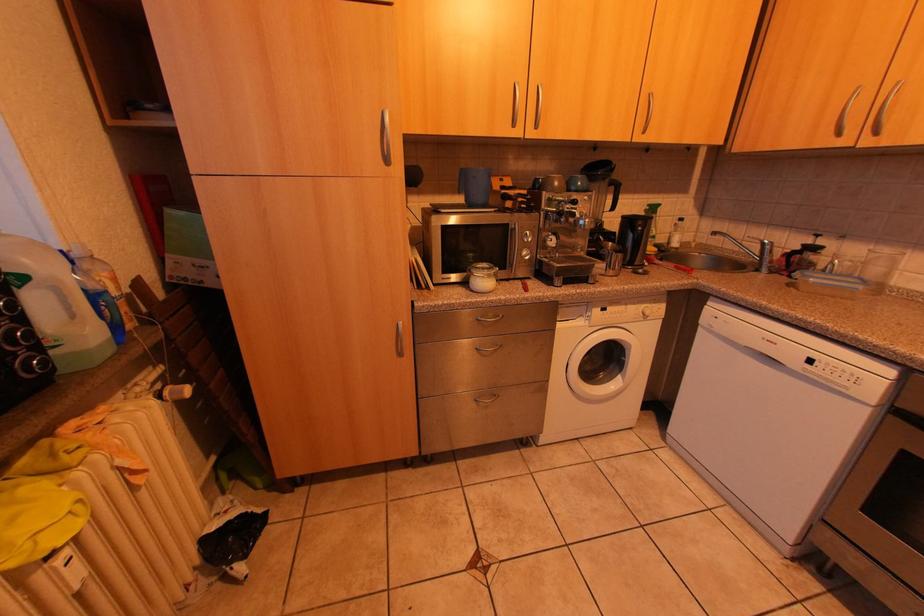
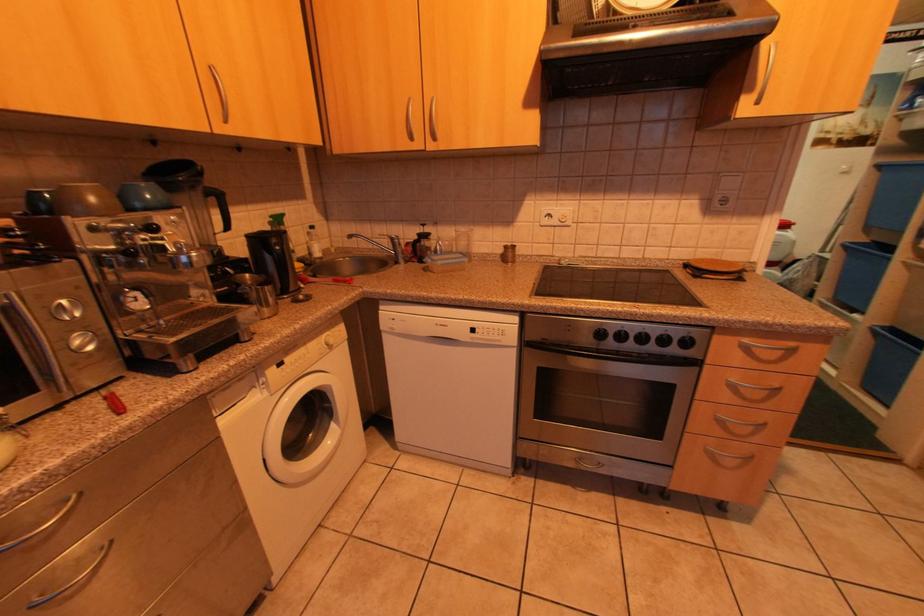
Question: The camera is either moving clockwise (left) or counter-clockwise (right) around the object. The first image is from the beginning of the video and the second image is from the end. Is the camera moving left or right when shooting the video?

Choices:
 (A) Left
 (B) Right

Answer: (A)